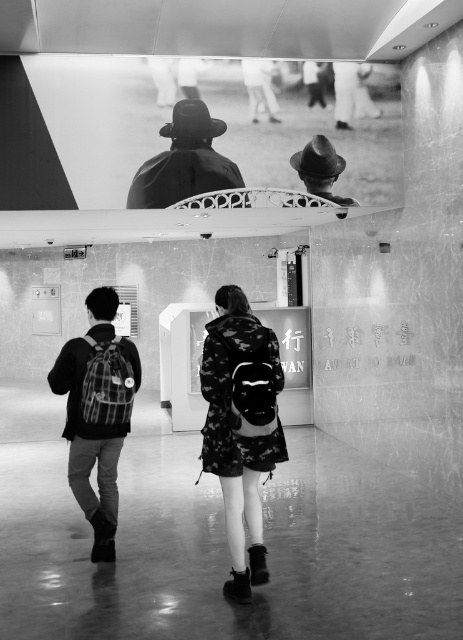
Looking at this image, you are an art curator examining the display case in the middle ground of the museum scene. You notice two matte black hats inside the case. Which one, the matte black hat at upper center or the matte black hat at center, is positioned higher up in the display?

The matte black hat at center is positioned higher up in the display because the matte black hat at upper center is located below it.